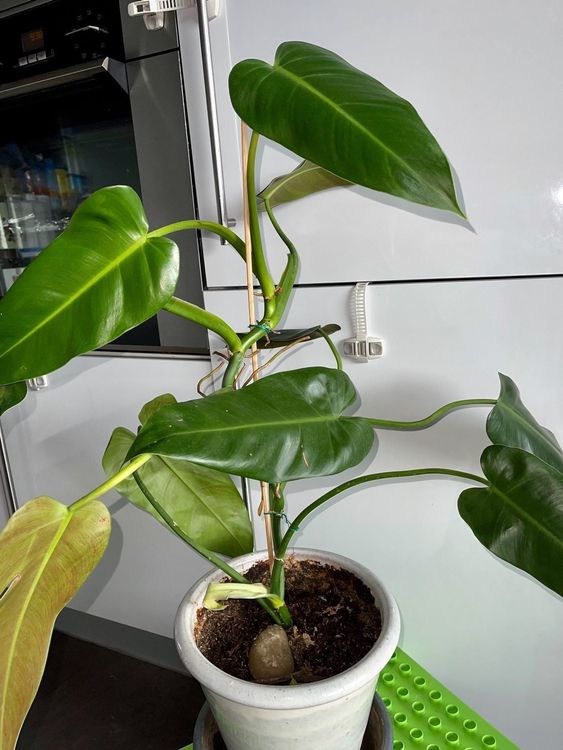
The width and height of the screenshot is (563, 750). Find the location of `tropical plant`. tropical plant is located at coordinates (253, 460).